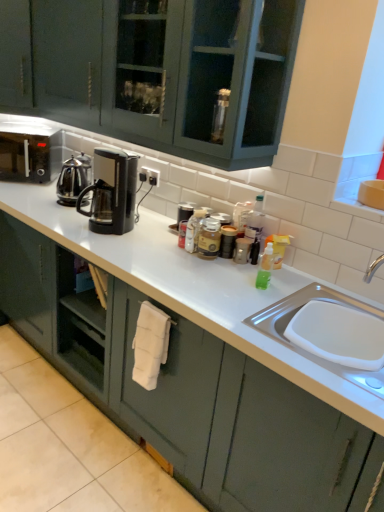
Where is `free point to the right of black plastic coffee maker at center, the first kitchen appliance viewed from the right`? Image resolution: width=384 pixels, height=512 pixels. free point to the right of black plastic coffee maker at center, the first kitchen appliance viewed from the right is located at coordinates (156, 231).